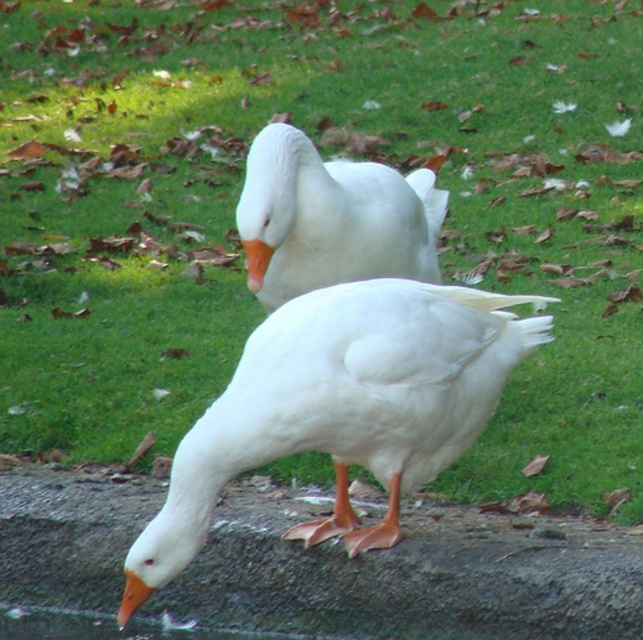
Question: Which point is farther from the camera taking this photo?

Choices:
 (A) (248, 241)
 (B) (131, 609)
 (C) (37, 580)

Answer: (C)

Question: Which point is closer to the camera taking this photo?

Choices:
 (A) (314, 378)
 (B) (255, 240)

Answer: (A)

Question: Does white feathered duck at center have a larger size compared to white matte goose at center?

Choices:
 (A) no
 (B) yes

Answer: (B)

Question: Is white matte goose at center behind orange matte beak at center?

Choices:
 (A) no
 (B) yes

Answer: (B)

Question: Which of the following is the farthest from the observer?

Choices:
 (A) orange matte beak at lower left
 (B) white feathered duck at center
 (C) concrete at lower left

Answer: (C)

Question: Is white feathered duck at center bigger than white matte goose at center?

Choices:
 (A) yes
 (B) no

Answer: (A)